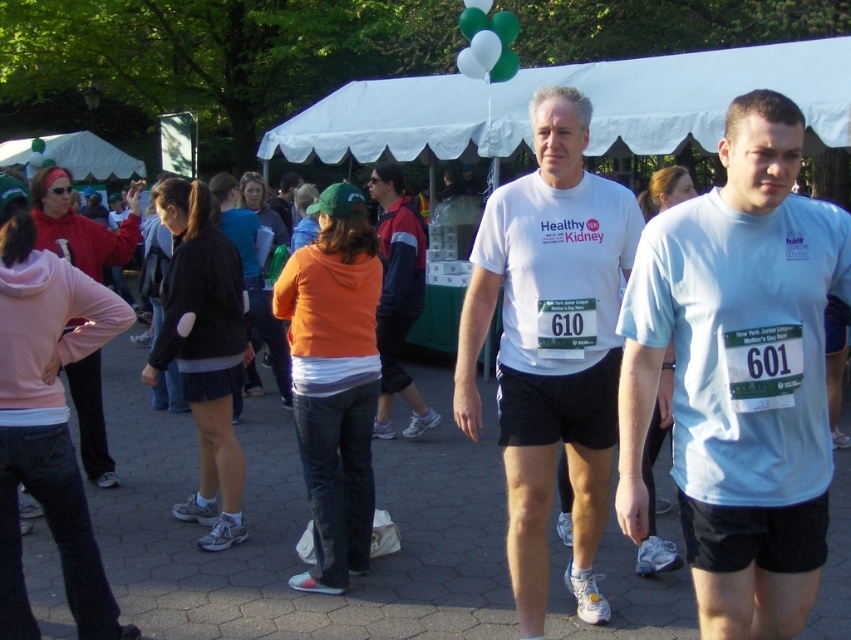
Question: Which object is the farthest from the white fabric canopy at upper center?

Choices:
 (A) matte pink hoodie at left
 (B) orange fleece at center
 (C) light blue t-shirt at center

Answer: (C)

Question: Can you confirm if light blue t-shirt at center is bigger than orange fabric jacket at center?

Choices:
 (A) yes
 (B) no

Answer: (B)

Question: Which point is farther from the camera taking this photo?

Choices:
 (A) (197, 337)
 (B) (524, 576)

Answer: (A)

Question: Among these points, which one is nearest to the camera?

Choices:
 (A) pos(390,381)
 (B) pos(80,323)

Answer: (B)

Question: In this image, where is orange fleece at center located relative to matte pink hoodie at left?

Choices:
 (A) left
 (B) right

Answer: (B)

Question: Is matte pink hoodie at left behind orange fabric jacket at center?

Choices:
 (A) no
 (B) yes

Answer: (A)